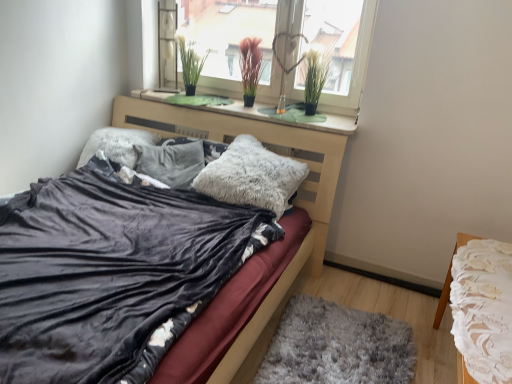
Question: In the image, is transparent glass window at upper center on the left side or the right side of green grass-like plant at upper center, which is the first plant in left-to-right order?

Choices:
 (A) left
 (B) right

Answer: (B)

Question: Is transparent glass window at upper center in front of or behind green grass-like plant at upper center, which is the first plant in left-to-right order, in the image?

Choices:
 (A) front
 (B) behind

Answer: (A)

Question: Which object is positioned farthest from the green grass-like plant at upper center, which is the first plant in left-to-right order?

Choices:
 (A) fuzzy gray pillow at center, the 1th pillow viewed from the left
 (B) white lace tablecloth at right
 (C) velvet black bed at center
 (D) green felt at upper center
 (E) transparent glass window at upper center

Answer: (B)

Question: Which of these objects is positioned farthest from the velvet black bed at center?

Choices:
 (A) transparent glass window at upper center
 (B) green grass-like plant at upper center, positioned as the 1th plant in right-to-left order
 (C) green felt at upper center
 (D) fuzzy gray pillow at center, which ranks as the 1th pillow in right-to-left order
 (E) white lace tablecloth at right

Answer: (E)